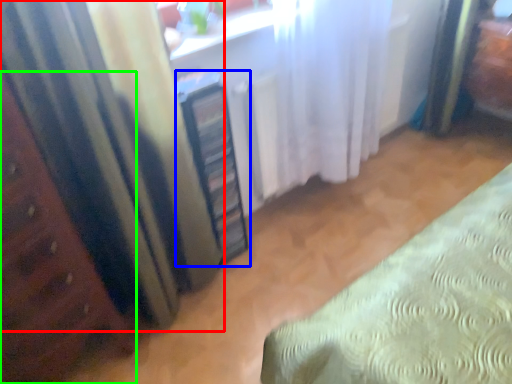
Question: Estimate the real-world distances between objects in this image. Which object is farther from curtain (highlighted by a red box), cabinetry (highlighted by a blue box) or furniture (highlighted by a green box)?

Choices:
 (A) cabinetry
 (B) furniture

Answer: (A)